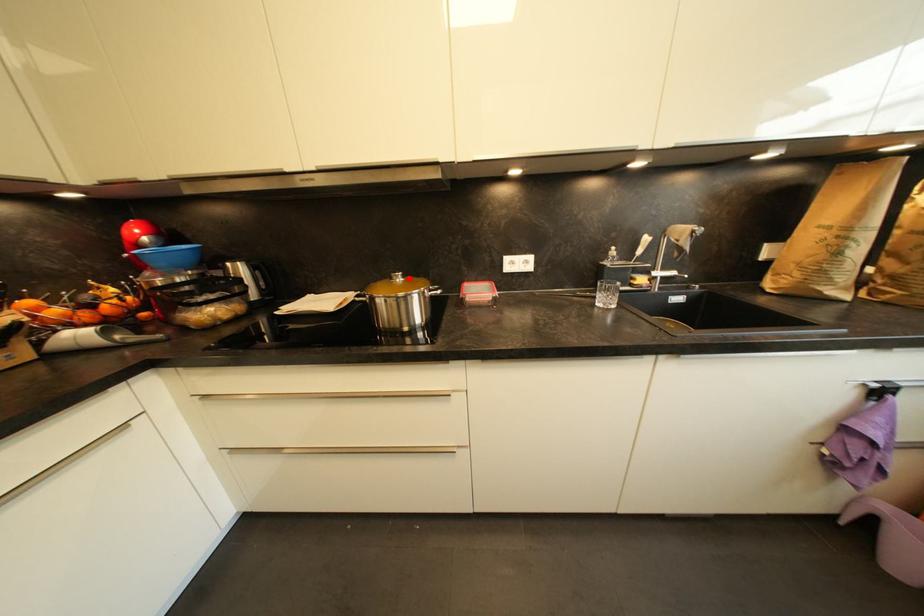
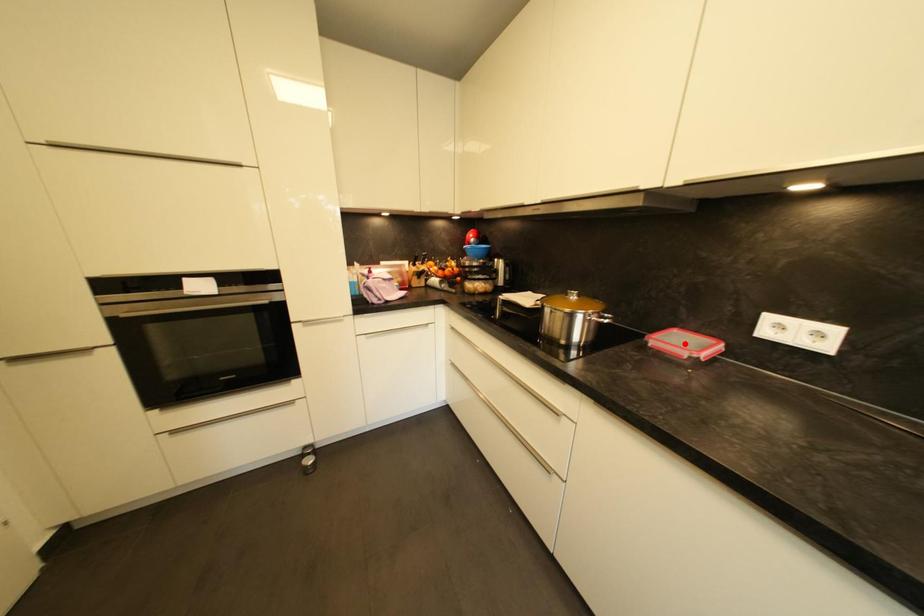
I am providing you with two images of the same scene from different viewpoints. A red point is marked on the first image and another point is marked on the second image. Does the point marked in image1 correspond to the same location as the one in image2?

No